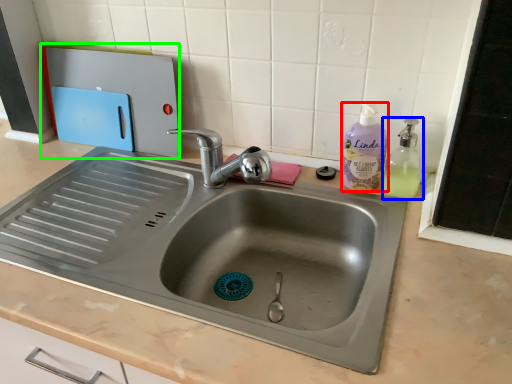
Question: Which is farther away from cleaning product (highlighted by a red box)? soap dispenser (highlighted by a blue box) or appliance (highlighted by a green box)?

Choices:
 (A) soap dispenser
 (B) appliance

Answer: (B)